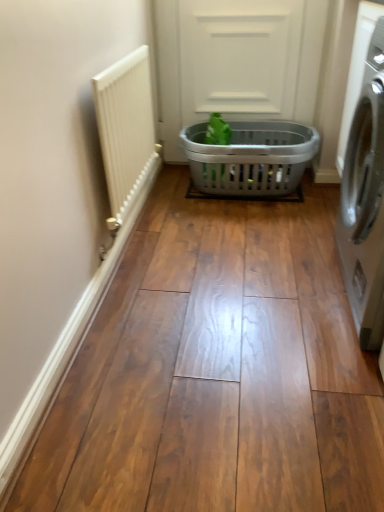
At what (x,y) coordinates should I click in order to perform the action: click on vacant space in white textured radiator at left (from a real-world perspective). Please return your answer as a coordinate pair (x, y). This screenshot has width=384, height=512. Looking at the image, I should click on pyautogui.click(x=137, y=226).